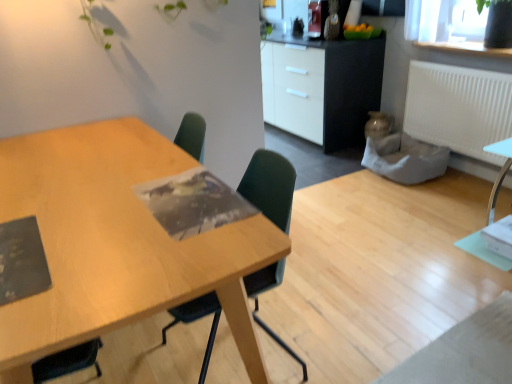
Where is `free space above wooden table at center (from a real-world perspective)`? free space above wooden table at center (from a real-world perspective) is located at coordinates (93, 188).